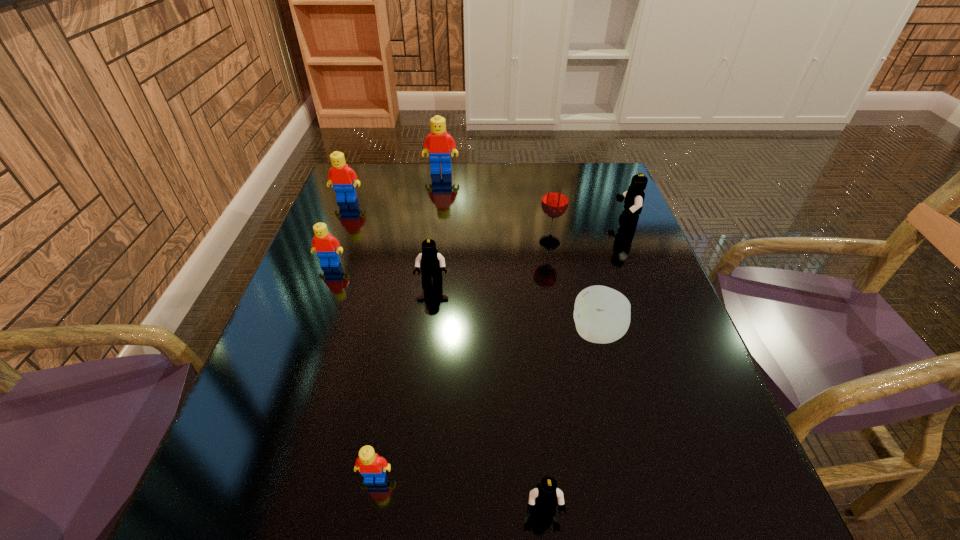
The width and height of the screenshot is (960, 540). I want to click on the farthest object, so click(439, 143).

At what (x,y) coordinates should I click in order to perform the action: click on the farthest Lego. Please return your answer as a coordinate pair (x, y). The width and height of the screenshot is (960, 540). Looking at the image, I should click on (439, 143).

Identify the location of glass. This screenshot has width=960, height=540. (555, 199).

Image resolution: width=960 pixels, height=540 pixels. I want to click on red glass, so click(x=555, y=199).

Identify the location of the farthest black Lego. This screenshot has height=540, width=960. (634, 197).

Locate an element on the screen. the seventh nearest object is located at coordinates (634, 197).

Locate an element on the screen. This screenshot has width=960, height=540. the sixth nearest Lego is located at coordinates (343, 178).

What are the coordinates of `the second farthest red Lego` in the screenshot? It's located at click(x=343, y=178).

Find the location of a particular element. The image size is (960, 540). the fifth nearest object is located at coordinates (327, 247).

Locate an element on the screen. The width and height of the screenshot is (960, 540). the second nearest red Lego is located at coordinates (327, 247).